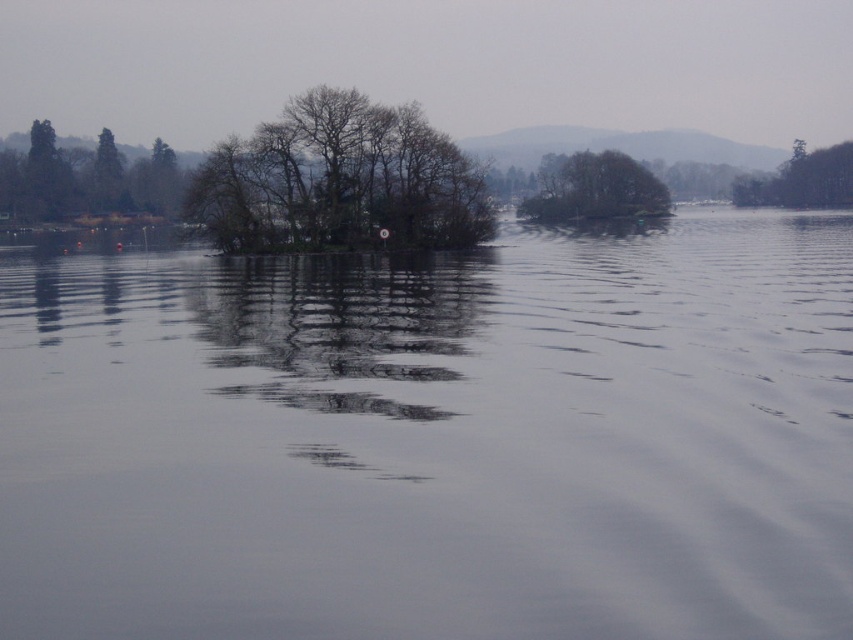
Which is behind, point (308, 378) or point (585, 192)?

Point (585, 192)

Can you confirm if transparent water at center is positioned to the left of green leafy tree at center?

Yes, transparent water at center is to the left of green leafy tree at center.

Find the location of a particular element. This screenshot has height=640, width=853. transparent water at center is located at coordinates (434, 440).

Is transparent water at center to the right of green matte trees at upper left from the viewer's perspective?

Correct, you'll find transparent water at center to the right of green matte trees at upper left.

At what (x,y) coordinates should I click in order to perform the action: click on transparent water at center. Please return your answer as a coordinate pair (x, y). The image size is (853, 640). Looking at the image, I should click on (434, 440).

Can you confirm if bare branches island at center is thinner than green leafy tree at center?

No.

Does bare branches island at center have a greater width compared to green leafy tree at center?

Indeed, bare branches island at center has a greater width compared to green leafy tree at center.

Is point (355, 120) positioned behind point (598, 220)?

That is False.

Where is `bare branches island at center`? This screenshot has width=853, height=640. bare branches island at center is located at coordinates (339, 180).